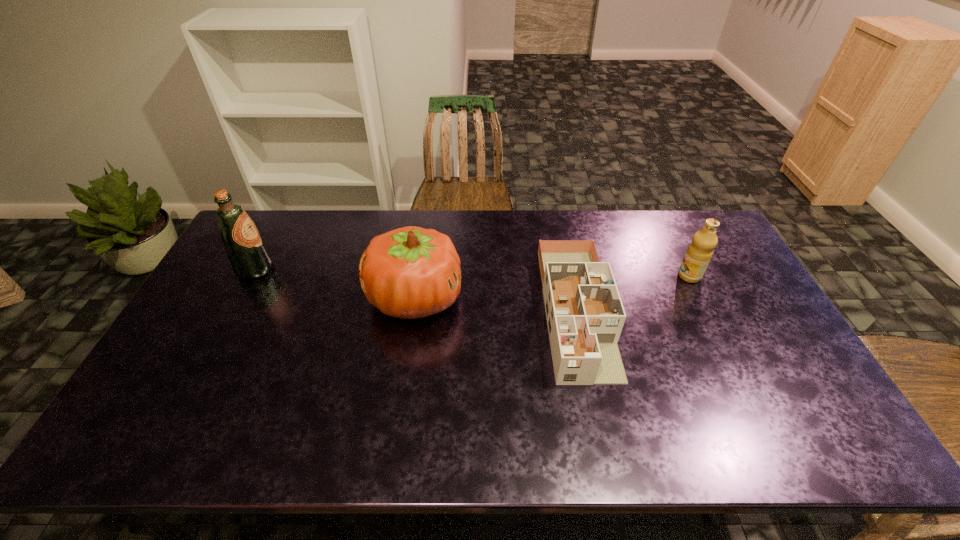
Find the location of a particular element. Image resolution: width=960 pixels, height=540 pixels. the leftmost object is located at coordinates (249, 256).

Where is `the left olive oil`? The height and width of the screenshot is (540, 960). the left olive oil is located at coordinates (249, 256).

This screenshot has height=540, width=960. What are the coordinates of `pumpkin` in the screenshot? It's located at (410, 272).

The width and height of the screenshot is (960, 540). Find the location of `the rightmost object`. the rightmost object is located at coordinates (699, 253).

Find the location of `the second shortest object`. the second shortest object is located at coordinates (699, 253).

Find the location of a particular element. Image resolution: width=960 pixels, height=540 pixels. the second object from right to left is located at coordinates (585, 315).

Find the location of a particular element. the shortest object is located at coordinates (585, 315).

Where is `vacant space located 0.190m on the front-facing side of the left olive oil`? This screenshot has height=540, width=960. vacant space located 0.190m on the front-facing side of the left olive oil is located at coordinates (333, 269).

Find the location of a particular element. This screenshot has height=540, width=960. vacant space located 0.230m on the side of the pumpkin with the cute face is located at coordinates tap(537, 298).

At what (x,y) coordinates should I click in order to perform the action: click on free region located 0.160m on the label of the rightmost object. Please return your answer as a coordinate pair (x, y). Looking at the image, I should click on (629, 276).